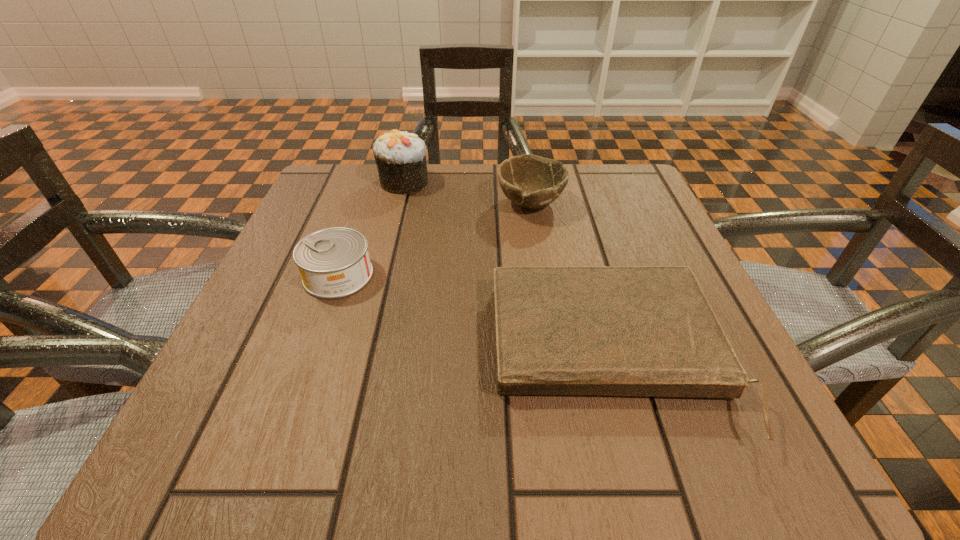
Identify the location of cupcake. tap(400, 157).

The image size is (960, 540). What are the coordinates of `the second tallest object` in the screenshot? It's located at (529, 181).

Find the location of a particular element. This screenshot has height=540, width=960. can is located at coordinates tap(334, 262).

This screenshot has width=960, height=540. What are the coordinates of `the shortest object` in the screenshot? It's located at (650, 331).

Find the location of a particular element. The image size is (960, 540). vacant area situated on the left of the tallest object is located at coordinates (340, 181).

Identify the location of blank area located on the front of the bowl. (548, 314).

Where is `free spot located on the back of the second shortest object`? The height and width of the screenshot is (540, 960). free spot located on the back of the second shortest object is located at coordinates (372, 182).

Where is `cupcake at the far edge`? Image resolution: width=960 pixels, height=540 pixels. cupcake at the far edge is located at coordinates (400, 157).

Image resolution: width=960 pixels, height=540 pixels. I want to click on bowl located in the far edge section of the desktop, so click(529, 181).

In order to click on object located in the near edge section of the desktop in this screenshot , I will do `click(650, 331)`.